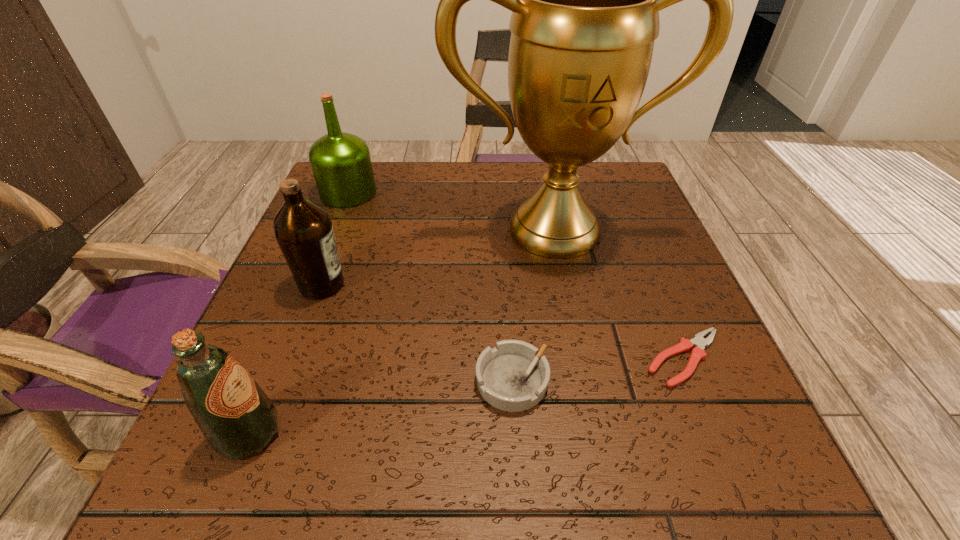
Where is `vacant space at the far edge of the desktop`? Image resolution: width=960 pixels, height=540 pixels. vacant space at the far edge of the desktop is located at coordinates (519, 175).

The width and height of the screenshot is (960, 540). What are the coordinates of `vacant space at the near edge of the desktop` in the screenshot? It's located at (453, 447).

What are the coordinates of `free space at the left edge of the desktop` in the screenshot? It's located at (319, 334).

Find the location of `vacant space at the right edge of the desktop`. vacant space at the right edge of the desktop is located at coordinates (614, 306).

Image resolution: width=960 pixels, height=540 pixels. Identify the location of free region at the far left corner of the desktop. (368, 212).

In the image, there is a desktop. Identify the location of vacant space at the far right corner. 613,173.

Identify the location of vacant region between the fifth tallest object and the second nearest olive oil. (417, 333).

Locate an element on the screen. The height and width of the screenshot is (540, 960). vacant area that lies between the pliers and the nearest olive oil is located at coordinates (467, 396).

This screenshot has height=540, width=960. Find the location of `vacant space that is in between the tallest object and the second nearest olive oil`. vacant space that is in between the tallest object and the second nearest olive oil is located at coordinates (438, 257).

In order to click on vacant area between the tallest object and the second nearest olive oil in this screenshot , I will do point(438,257).